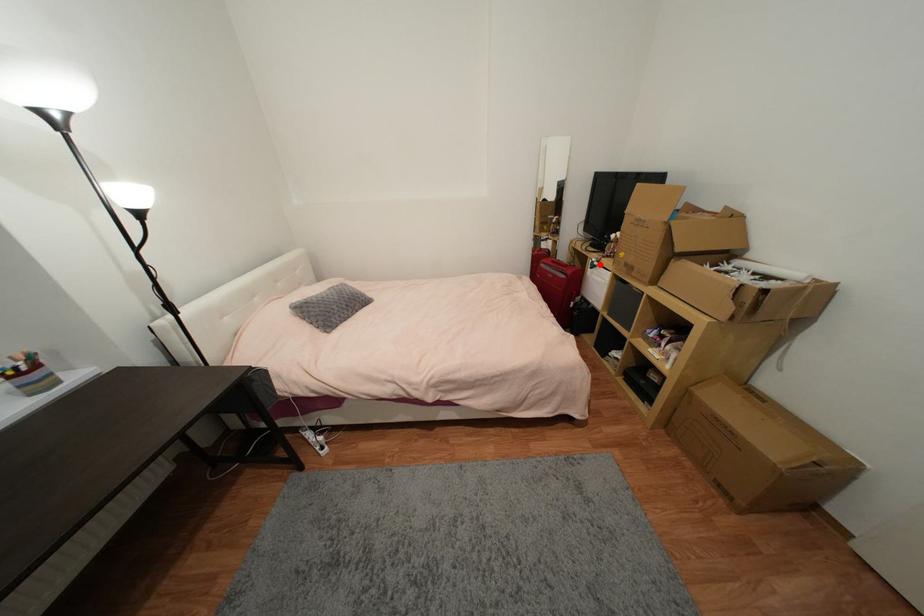
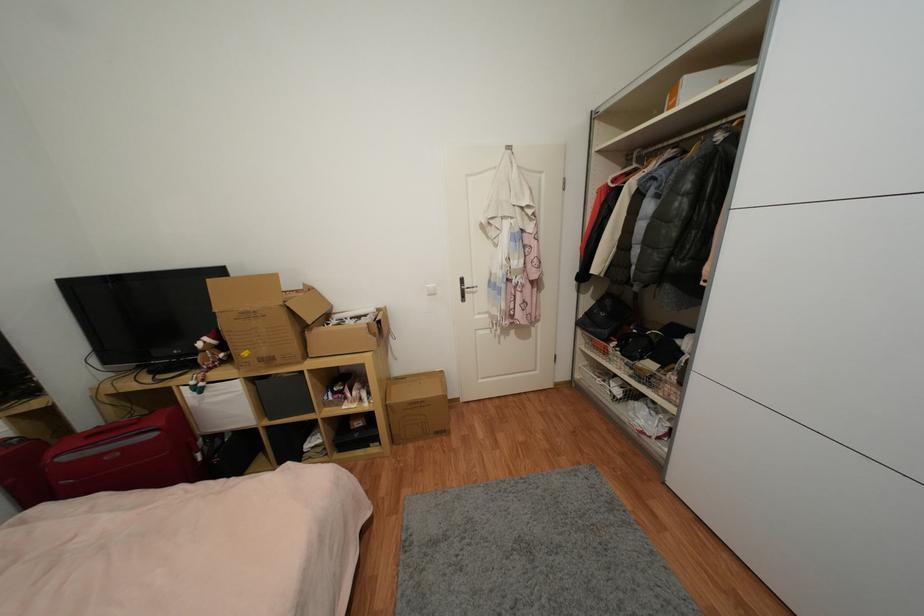
Question: I am providing you with two images of the same scene from different viewpoints. A red point is shown in image1. For the corresponding object point in image2, is it positioned nearer or farther from the camera?

Choices:
 (A) Nearer
 (B) Farther

Answer: (B)